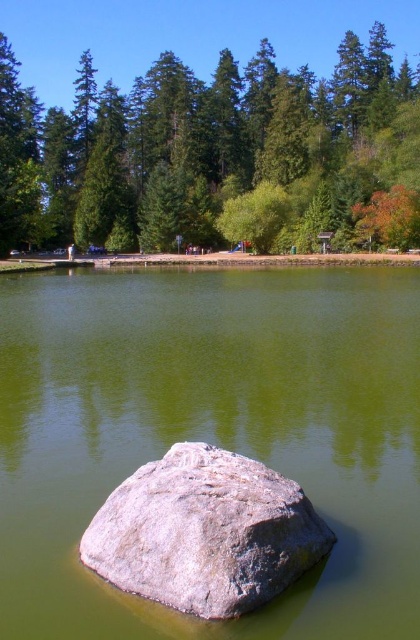
You are standing in the serene natural scene and want to take a photo. There are two points in the scene marked as point 1 at coordinates (301,596) and point 2 at coordinates (362,173). Which point should you focus on to ensure the foreground rock is in sharp focus?

Point 1 at coordinates (301,596) should be focused on because it is closer to the camera than point 2 at coordinates (362,173), ensuring the foreground rock remains in sharp focus.

You are standing at the edge of the water and see the smooth gray rock at center and the gray rough rock at center. Which rock is closer to the water surface?

The smooth gray rock at center is above the gray rough rock at center, so it is closer to the water surface.

You are standing at the edge of the water and want to place a small statue on the tallest object in the scene. Which object should you choose between the smooth gray rock at center and the green matte tree at upper center?

The green matte tree at upper center is taller than the smooth gray rock at center, so you should place the small statue on the green matte tree at upper center.